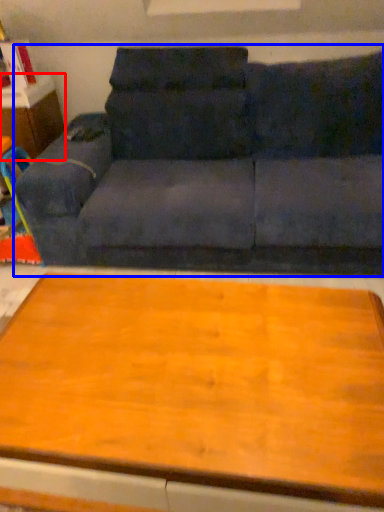
Question: Which object is closer to the camera taking this photo, dresser (highlighted by a red box) or studio couch (highlighted by a blue box)?

Choices:
 (A) dresser
 (B) studio couch

Answer: (B)